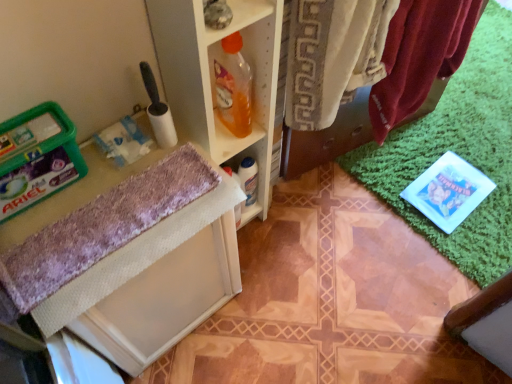
The height and width of the screenshot is (384, 512). In order to click on free space above purple fuzzy bath towel at lower left (from a real-world perspective) in this screenshot , I will do `click(110, 215)`.